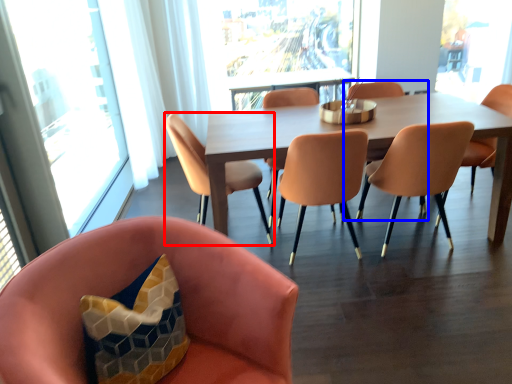
Question: Which point is further to the camera, chair (highlighted by a red box) or armchair (highlighted by a blue box)?

Choices:
 (A) chair
 (B) armchair

Answer: (B)